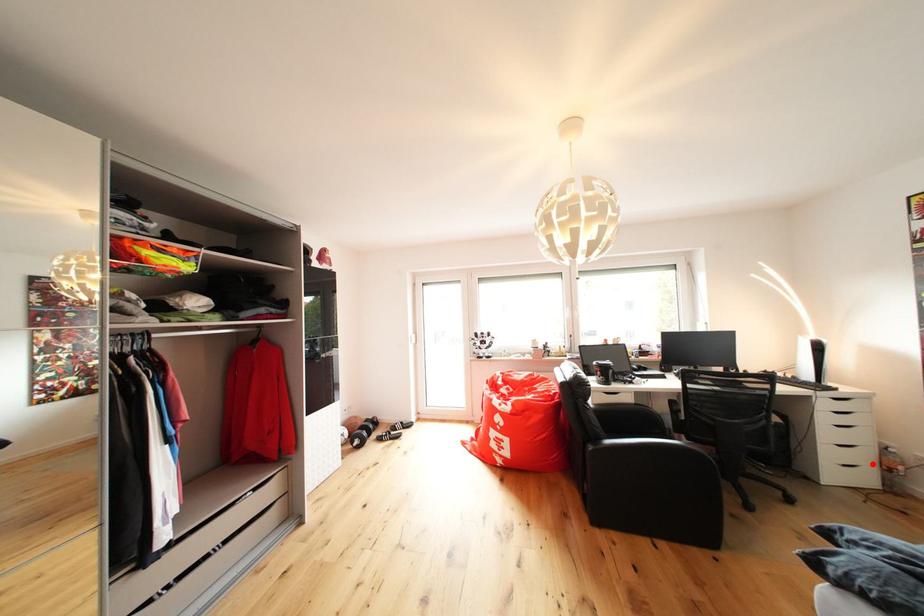
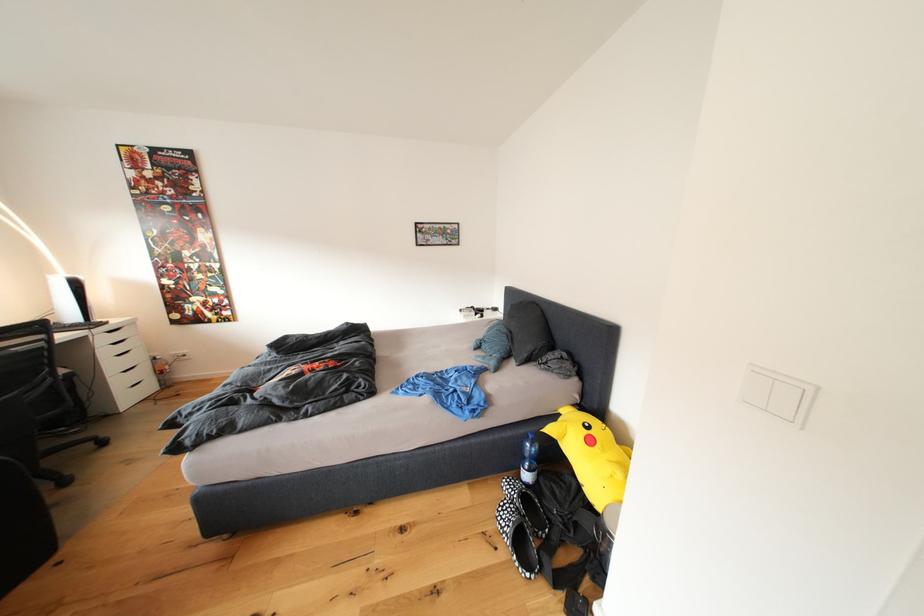
Locate, in the second image, the point that corresponds to the highlighted location in the first image.

(152, 379)